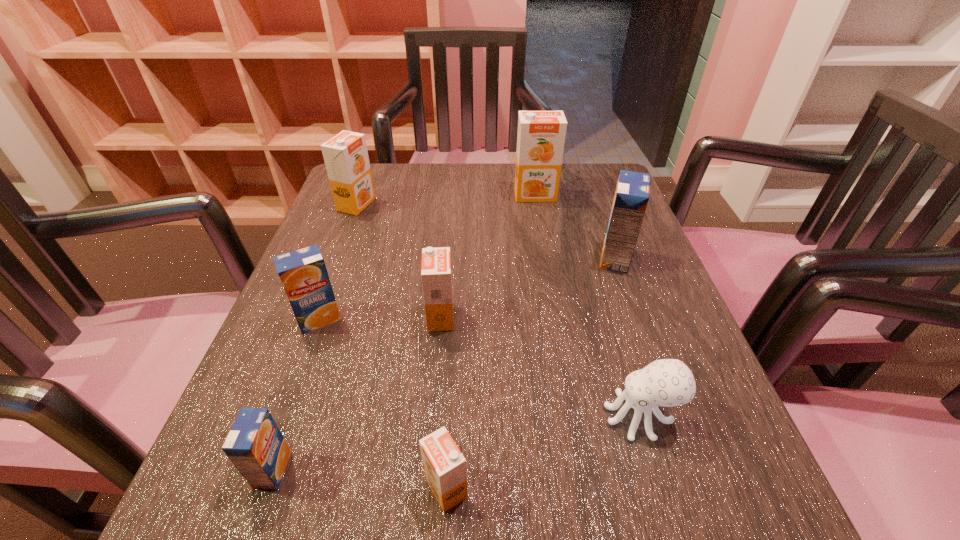
This screenshot has width=960, height=540. What are the coordinates of `object that is the seventh closest to the biggest blue orange_juice` in the screenshot? It's located at (255, 445).

Locate an element on the screen. This screenshot has height=540, width=960. orange_juice that stands as the third closest to the second farthest blue orange_juice is located at coordinates (x=346, y=158).

The height and width of the screenshot is (540, 960). I want to click on the second closest orange_juice to the second farthest blue orange_juice, so click(x=255, y=445).

Identify which orange orange juice is located as the third nearest to the farthest blue orange_juice. Please provide its 2D coordinates. Your answer should be formatted as a tuple, i.e. [(x, y)], where the tuple contains the x and y coordinates of a point satisfying the conditions above.

[(444, 465)]

Select which orange orange juice appears as the second closest to the octopus. Please provide its 2D coordinates. Your answer should be formatted as a tuple, i.e. [(x, y)], where the tuple contains the x and y coordinates of a point satisfying the conditions above.

[(436, 275)]

Select which blue orange_juice is the closest to the smallest blue orange_juice. Please provide its 2D coordinates. Your answer should be formatted as a tuple, i.e. [(x, y)], where the tuple contains the x and y coordinates of a point satisfying the conditions above.

[(303, 273)]

Identify the location of blue orange_juice that stands as the closest to the nearest blue orange_juice. (303, 273).

At what (x,y) coordinates should I click in order to perform the action: click on free space that satisfies the following two spatial constraints: 1. on the back side of the tallest object; 2. on the left side of the third farthest orange orange juice. Please return your answer as a coordinate pair (x, y). Looking at the image, I should click on (452, 195).

This screenshot has width=960, height=540. I want to click on blank space that satisfies the following two spatial constraints: 1. on the back side of the leftmost orange orange juice; 2. on the left side of the biggest orange orange juice, so click(360, 195).

Locate an element on the screen. vacant region that satisfies the following two spatial constraints: 1. on the back side of the second smallest blue orange_juice; 2. on the right side of the tallest orange_juice is located at coordinates (364, 195).